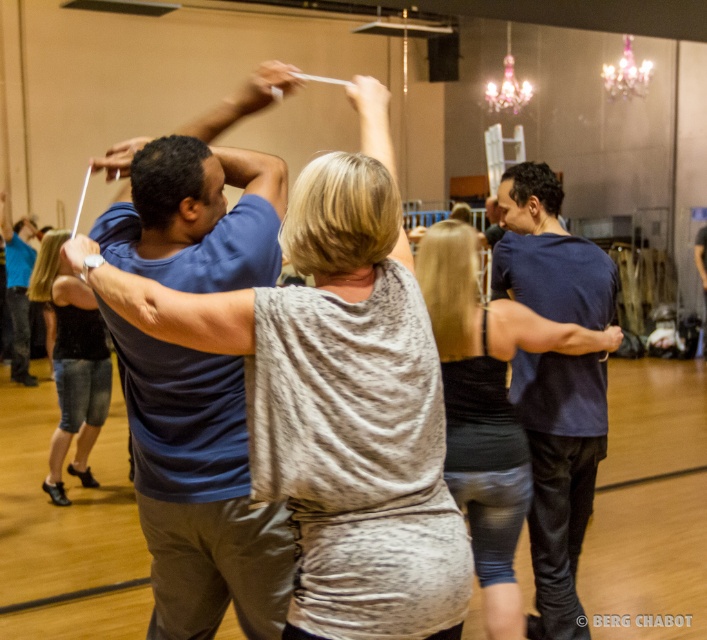
Question: Which point is closer to the camera?

Choices:
 (A) (13, 340)
 (B) (40, 244)

Answer: (B)

Question: Can you confirm if blue cotton shirt at center is positioned above dark blue shirt at center?

Choices:
 (A) no
 (B) yes

Answer: (B)

Question: Which object appears closest to the camera in this image?

Choices:
 (A) dark blue shirt at center
 (B) blue denim jeans at lower left

Answer: (A)

Question: Estimate the real-world distances between objects in this image. Which object is closer to the denim shorts at lower left?

Choices:
 (A) pink glass chandelier at upper center
 (B) blue cotton shirt at center
 (C) blue denim jeans at lower left

Answer: (B)

Question: Does dark blue shirt at center appear on the right side of pink glass chandelier at upper center?

Choices:
 (A) yes
 (B) no

Answer: (B)

Question: Does blue cotton shirt at center have a larger size compared to dark blue shirt at center?

Choices:
 (A) yes
 (B) no

Answer: (B)